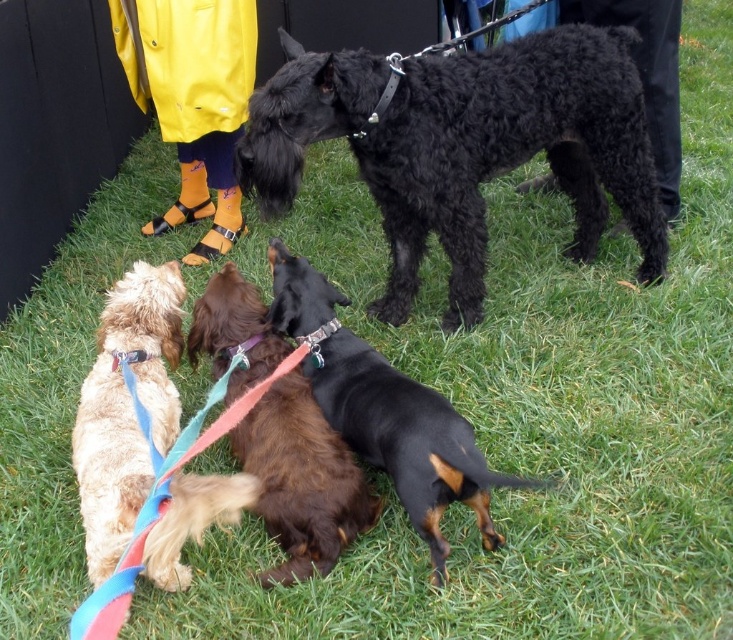
You are standing at the origin point in the image and want to locate the black curly fur dog at upper center. What are the coordinates of its position?

The black curly fur dog at upper center is located at point (464,145).

You are a photographer setting up a tripod to capture the shiny golden fur at lower left and the brown shaggy dog at center. The tripod has a maximum extension of 1.2 meters. Can you fit both subjects within the frame without moving the tripod?

The distance between the shiny golden fur at lower left and the brown shaggy dog at center is 55.87 centimeters, which is less than the tripod maximum extension of 1.2 meters. Therefore, you can fit both subjects within the frame without moving the tripod.